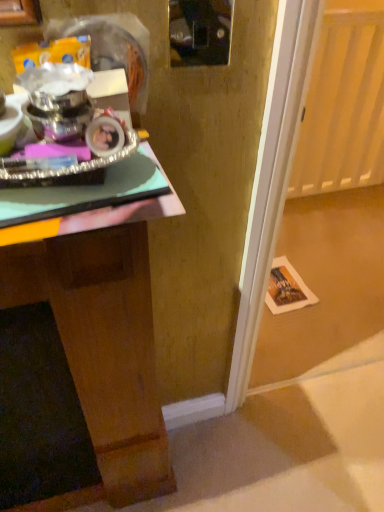
Question: Which is correct: wooden desk at left is inside transparent glass door at lower right, or outside of it?

Choices:
 (A) inside
 (B) outside

Answer: (B)

Question: Does point (142, 437) appear closer or farther from the camera than point (362, 219)?

Choices:
 (A) closer
 (B) farther

Answer: (A)

Question: From a real-world perspective, is wooden desk at left above or below transparent glass door at lower right?

Choices:
 (A) above
 (B) below

Answer: (B)

Question: From a real-world perspective, relative to wooden desk at left, is transparent glass door at lower right vertically above or below?

Choices:
 (A) above
 (B) below

Answer: (A)

Question: From the image's perspective, is transparent glass door at lower right above or below wooden desk at left?

Choices:
 (A) below
 (B) above

Answer: (B)

Question: Is transparent glass door at lower right inside the boundaries of wooden desk at left, or outside?

Choices:
 (A) outside
 (B) inside

Answer: (A)

Question: Is transparent glass door at lower right wider or thinner than wooden desk at left?

Choices:
 (A) thin
 (B) wide

Answer: (A)